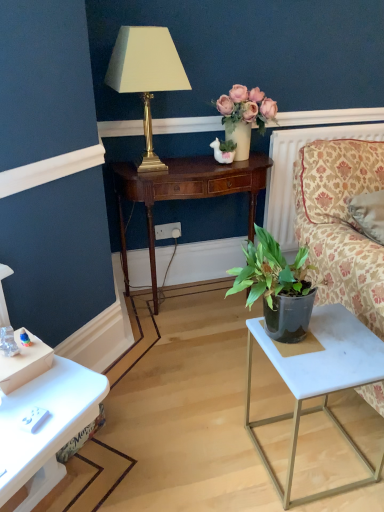
I want to click on free spot in front of mahogany wood table at center, so click(x=191, y=374).